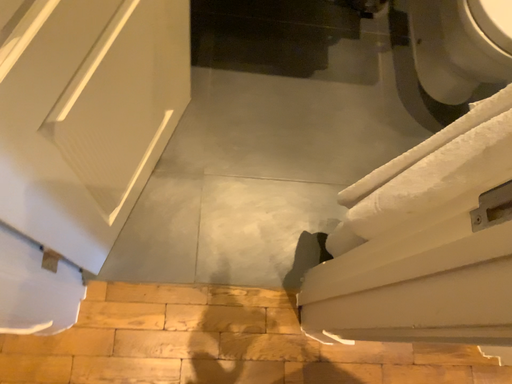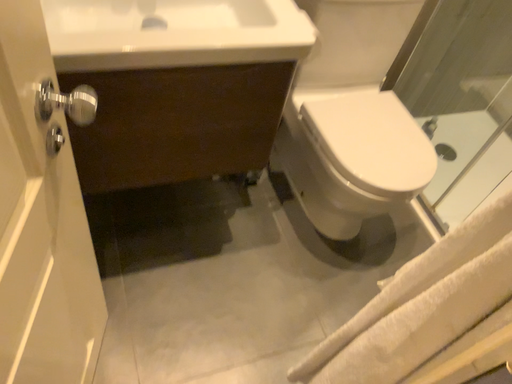
Question: Which way did the camera rotate in the video?

Choices:
 (A) rotated downward
 (B) rotated upward

Answer: (B)